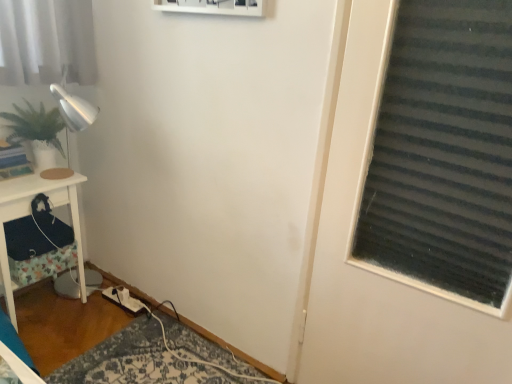
Question: Considering the positions of green matte plant at left and white fabric extension cord at lower left in the image, is green matte plant at left wider or thinner than white fabric extension cord at lower left?

Choices:
 (A) thin
 (B) wide

Answer: (A)

Question: Is green matte plant at left bigger or smaller than white fabric extension cord at lower left?

Choices:
 (A) big
 (B) small

Answer: (A)

Question: Considering the real-world distances, which object is closest to the white wood side table at left?

Choices:
 (A) white fabric extension cord at lower left
 (B) green matte plant at left

Answer: (B)

Question: Based on their relative distances, which object is farther from the white wood side table at left?

Choices:
 (A) green matte plant at left
 (B) white fabric extension cord at lower left

Answer: (B)